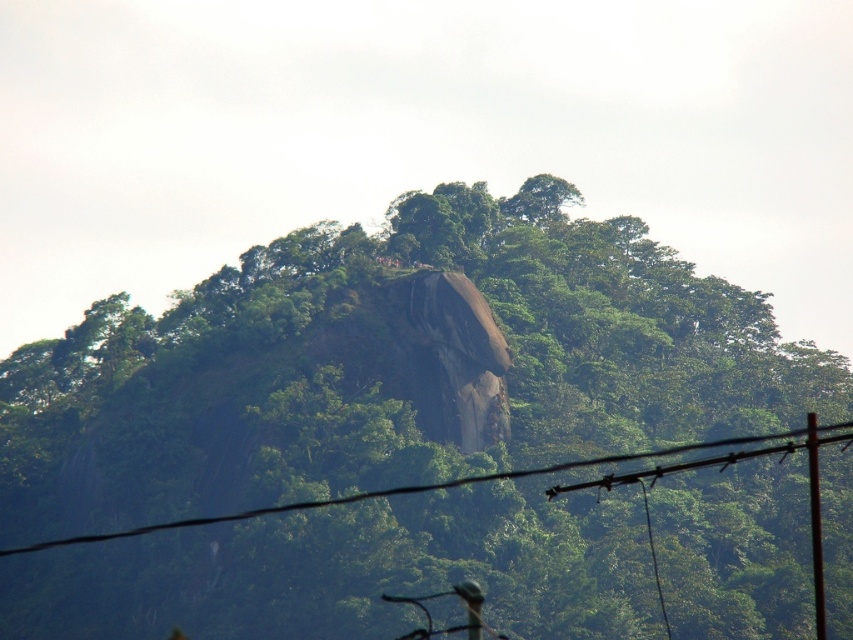
Is point (523, 456) farther from viewer compared to point (462, 483)?

That is True.

Does point (374, 413) lie behind point (96, 534)?

No, it is not.

The width and height of the screenshot is (853, 640). Find the location of `green leafy tree at center`. green leafy tree at center is located at coordinates (393, 364).